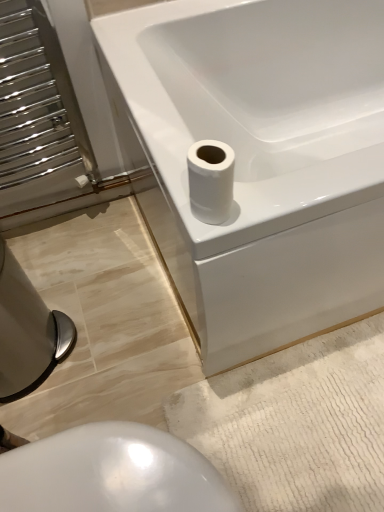
This screenshot has height=512, width=384. I want to click on vacant area on top of white glossy bidet at lower center, which is counted as the 2th bidet, starting from the left (from a real-world perspective), so click(91, 468).